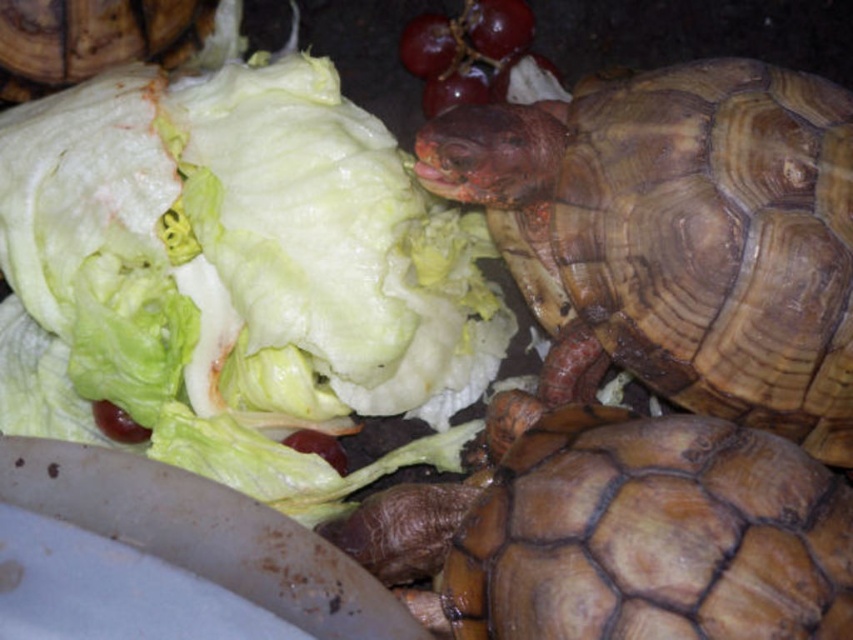
Question: Can you confirm if brown leathery tortoise at lower right is wider than glossy purple grapes at upper center?

Choices:
 (A) yes
 (B) no

Answer: (A)

Question: Does brown leathery tortoise at lower right appear on the left side of brown matte shell at upper left?

Choices:
 (A) yes
 (B) no

Answer: (B)

Question: Which point appears closest to the camera in this image?

Choices:
 (A) (311, 499)
 (B) (595, 337)
 (C) (439, 88)

Answer: (B)

Question: Which point is closer to the camera?

Choices:
 (A) glossy purple grapes at upper center
 (B) brown matte shell at upper left

Answer: (B)

Question: Does brown matte shell at upper left have a larger size compared to glossy purple grapes at upper center?

Choices:
 (A) yes
 (B) no

Answer: (A)

Question: Which object appears closest to the camera in this image?

Choices:
 (A) brown matte shell at upper left
 (B) glossy purple grapes at upper center
 (C) brown leathery tortoise at center
 (D) green leafy lettuce at upper left

Answer: (C)